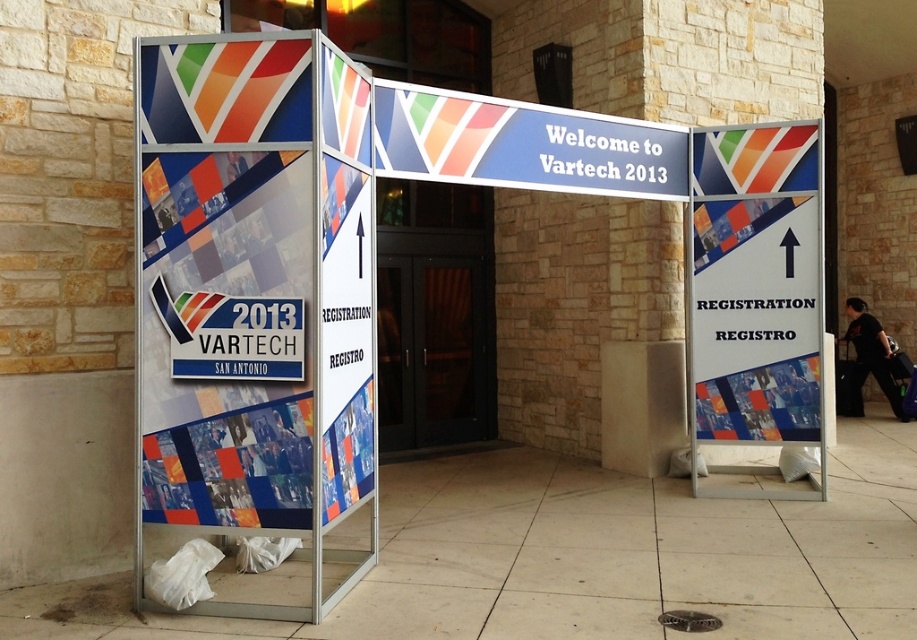
Question: Which of the following is the closest to the observer?

Choices:
 (A) matte plastic sign at center
 (B) white plastic sign at center

Answer: (A)

Question: Which point is closer to the camera?

Choices:
 (A) blue glossy sign at center
 (B) white plastic sign at center

Answer: (A)

Question: Does matte plastic sign at center have a lesser width compared to white plastic sign at center?

Choices:
 (A) no
 (B) yes

Answer: (A)

Question: Does white plastic sign at center have a larger size compared to blue glossy sign at center?

Choices:
 (A) yes
 (B) no

Answer: (B)

Question: Does white plastic sign at center have a lesser width compared to blue glossy sign at center?

Choices:
 (A) yes
 (B) no

Answer: (A)

Question: Which of the following is the closest to the observer?

Choices:
 (A) blue glossy sign at center
 (B) matte plastic sign at center
 (C) white plastic sign at center

Answer: (B)